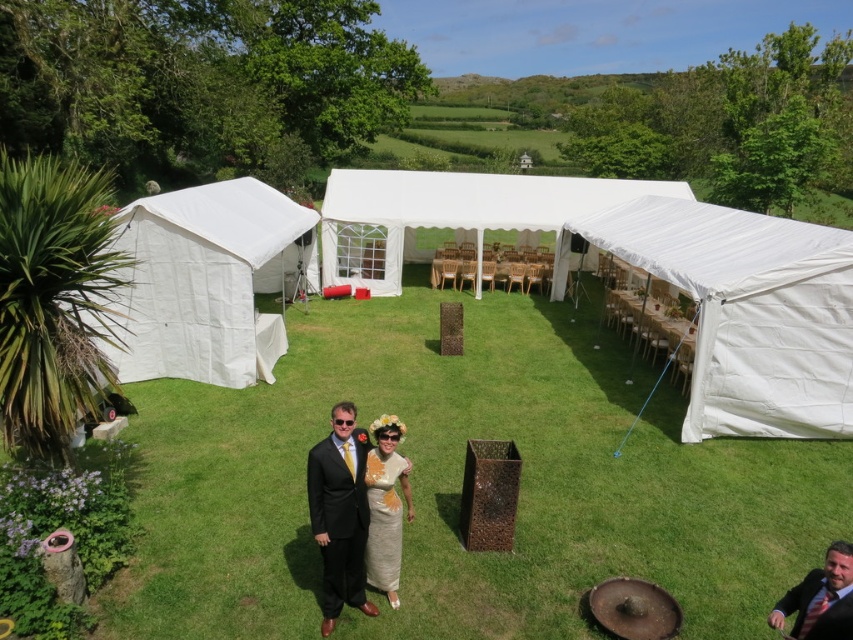
You are a photographer at the wedding venue. You need to position a large camera tripod in the center of the area between the white fabric tent at right and the matte black suit at center. Can you fit the tripod there if it requires a space of at least 1.2 meters in width?

The white fabric tent at right might be wider than matte black suit at center, so the available space between them could vary. However, without exact measurements, it is uncertain if the 1.2 meters requirement is met. Consider checking the actual distance before placing the tripod.

You are a photographer at the wedding venue. You need to position yourself so that you can capture both the green grass at center and the matte black suit at center in the same frame. Based on their positions, which object should you focus on first to ensure both are in the shot?

The green grass at center is located above the matte black suit at center, so you should focus on the matte black suit at center first to ensure both are in the shot.